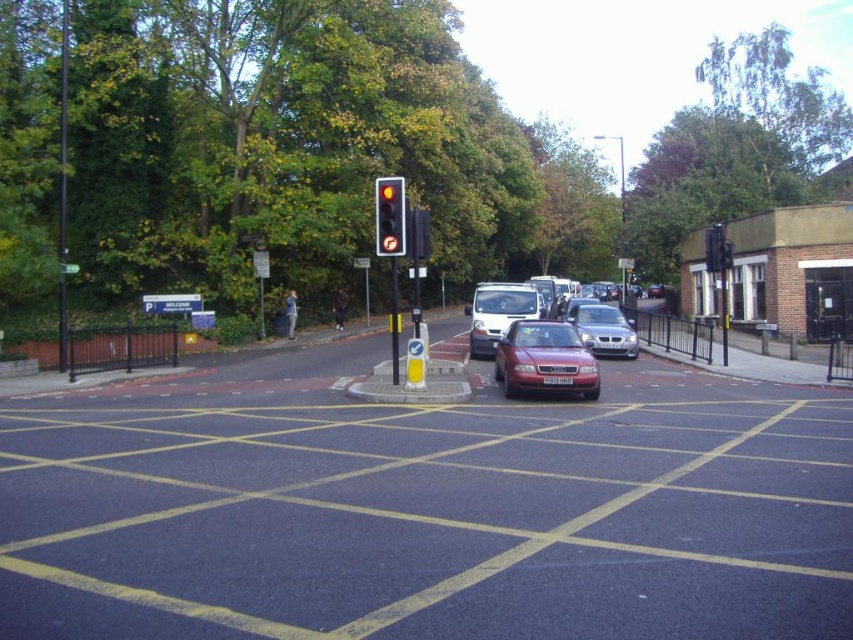
Can you confirm if shiny red sedan at center is positioned below red glass traffic light at center?

Indeed, shiny red sedan at center is positioned under red glass traffic light at center.

Consider the image. Is shiny red sedan at center taller than red glass traffic light at center?

Incorrect, shiny red sedan at center's height is not larger of red glass traffic light at center's.

Is point (482, 355) closer to viewer compared to point (376, 193)?

No, (482, 355) is behind (376, 193).

Where is `shiny red sedan at center`? This screenshot has height=640, width=853. shiny red sedan at center is located at coordinates (498, 312).

In the scene shown: How distant is metallic silver car at center from red glass traffic light at center?

metallic silver car at center is 26.60 feet away from red glass traffic light at center.

Is metallic silver car at center bigger than red glass traffic light at center?

Incorrect, metallic silver car at center is not larger than red glass traffic light at center.

Where is `metallic silver car at center`? metallic silver car at center is located at coordinates (604, 330).

Does shiny red car at center appear over red glass traffic light at center?

Actually, shiny red car at center is below red glass traffic light at center.

Based on the photo, is shiny red car at center thinner than red glass traffic light at center?

Correct, shiny red car at center's width is less than red glass traffic light at center's.

What do you see at coordinates (544, 358) in the screenshot?
I see `shiny red car at center` at bounding box center [544, 358].

At what (x,y) coordinates should I click in order to perform the action: click on shiny red car at center. Please return your answer as a coordinate pair (x, y). This screenshot has width=853, height=640. Looking at the image, I should click on (544, 358).